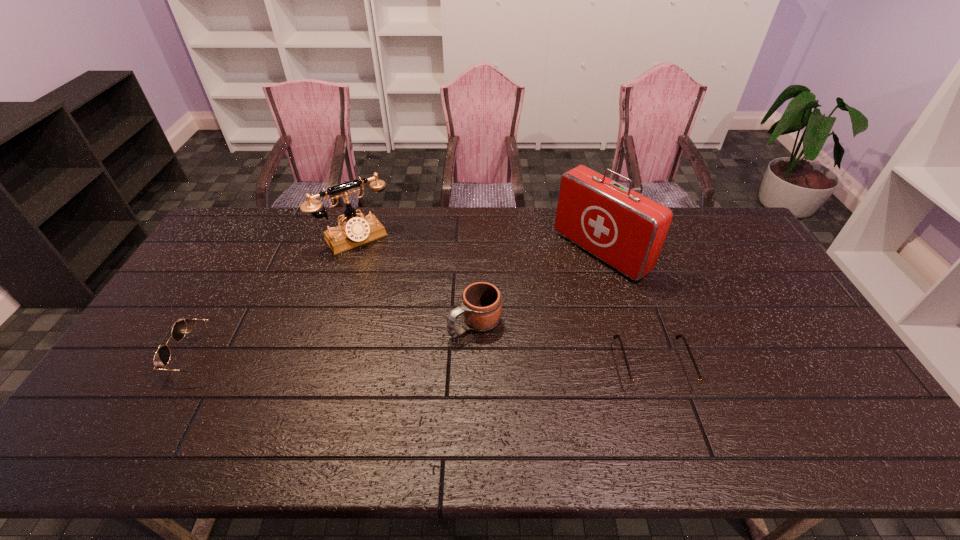
This screenshot has width=960, height=540. In order to click on vacant region that satisfies the following two spatial constraints: 1. on the back side of the third tallest object; 2. on the right side of the first-aid kit in this screenshot , I will do `click(475, 252)`.